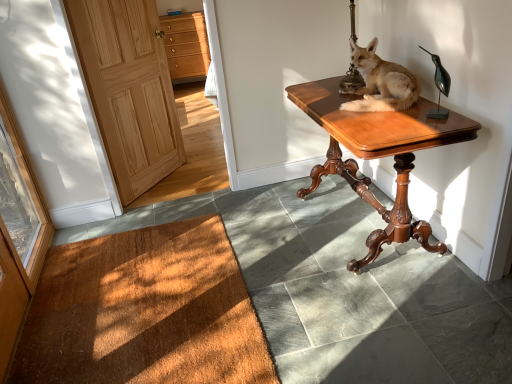
This screenshot has height=384, width=512. What are the coordinates of `free space between light brown fur at center and bronze metallic bird at upper right` in the screenshot? It's located at (406, 116).